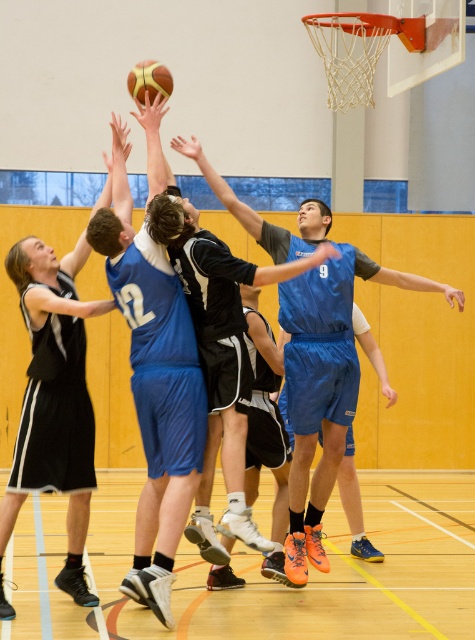
You are a referee in the basketball game. You need to determine which player is more likely to reach the basketball hoop first based on their height. Which player, the black jersey at center or the blue jersey at center, is taller?

The black jersey at center is much taller than the blue jersey at center, so the black jersey at center is more likely to reach the basketball hoop first due to their height advantage.

In the scene shown: You are a referee observing the basketball game. You need to determine if the player in the blue jersey at center can legally reach the shiny golden basketball at upper center without jumping. Based on their height, is this possible?

The blue jersey at center is much taller than the shiny golden basketball at upper center, so they can easily reach it without jumping.